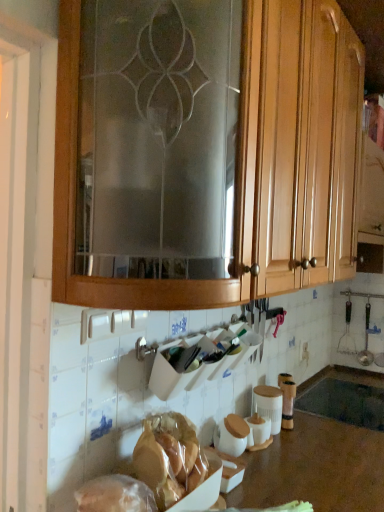
Question: Should I look upward or downward to see translucent plastic bag of bread at lower center, the first food viewed from the front?

Choices:
 (A) down
 (B) up

Answer: (A)

Question: Are translucent plastic bag at lower left, which is the first food in back-to-front order, and translucent plastic bag of bread at lower center, which ranks as the second food in back-to-front order, located far from each other?

Choices:
 (A) no
 (B) yes

Answer: (A)

Question: Is translucent plastic bag at lower left, which is the first food in back-to-front order, smaller than translucent plastic bag of bread at lower center, the first food viewed from the front?

Choices:
 (A) yes
 (B) no

Answer: (A)

Question: Can you confirm if translucent plastic bag at lower left, which is counted as the 2th food, starting from the front, is bigger than translucent plastic bag of bread at lower center, which ranks as the second food in back-to-front order?

Choices:
 (A) yes
 (B) no

Answer: (B)

Question: From a real-world perspective, is translucent plastic bag at lower left, which is the first food in back-to-front order, over translucent plastic bag of bread at lower center, which ranks as the second food in back-to-front order?

Choices:
 (A) no
 (B) yes

Answer: (B)

Question: Is translucent plastic bag at lower left, which is the first food in back-to-front order, oriented away from translucent plastic bag of bread at lower center, the first food viewed from the front?

Choices:
 (A) no
 (B) yes

Answer: (B)

Question: Could you tell me if translucent plastic bag at lower left, which is counted as the 2th food, starting from the front, is turned towards translucent plastic bag of bread at lower center, which ranks as the second food in back-to-front order?

Choices:
 (A) no
 (B) yes

Answer: (B)

Question: From a real-world perspective, is black matte sink at lower center on translucent plastic bag of bread at lower center, which ranks as the second food in back-to-front order?

Choices:
 (A) no
 (B) yes

Answer: (A)

Question: Does black matte sink at lower center have a lesser height compared to translucent plastic bag of bread at lower center, which ranks as the second food in back-to-front order?

Choices:
 (A) no
 (B) yes

Answer: (B)

Question: Considering the relative positions of black matte sink at lower center and translucent plastic bag of bread at lower center, which ranks as the second food in back-to-front order, in the image provided, is black matte sink at lower center to the right of translucent plastic bag of bread at lower center, which ranks as the second food in back-to-front order, from the viewer's perspective?

Choices:
 (A) yes
 (B) no

Answer: (A)

Question: From the image's perspective, would you say black matte sink at lower center is positioned over translucent plastic bag of bread at lower center, which ranks as the second food in back-to-front order?

Choices:
 (A) yes
 (B) no

Answer: (B)

Question: From a real-world perspective, is black matte sink at lower center physically below translucent plastic bag of bread at lower center, the first food viewed from the front?

Choices:
 (A) no
 (B) yes

Answer: (B)

Question: Is black matte sink at lower center taller than translucent plastic bag of bread at lower center, the first food viewed from the front?

Choices:
 (A) no
 (B) yes

Answer: (A)

Question: Considering the relative sizes of translucent plastic bag at lower left, which is the first food in back-to-front order, and brown polished wood at lower center in the image provided, is translucent plastic bag at lower left, which is the first food in back-to-front order, wider than brown polished wood at lower center?

Choices:
 (A) no
 (B) yes

Answer: (A)